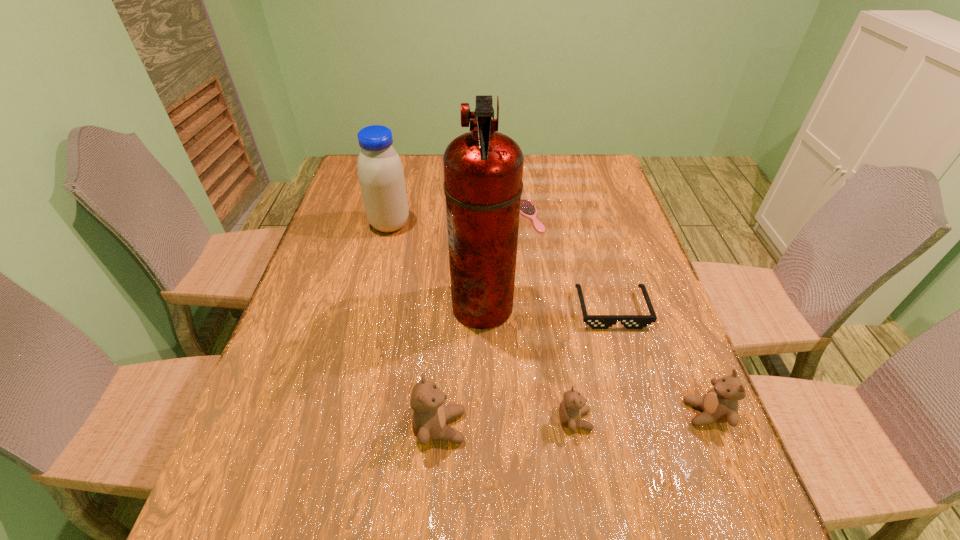
Please point out where to position a new teddy bear on the left to maintain spacing. Please provide its 2D coordinates. Your answer should be formatted as a tuple, i.e. [(x, y)], where the tuple contains the x and y coordinates of a point satisfying the conditions above.

[(301, 434)]